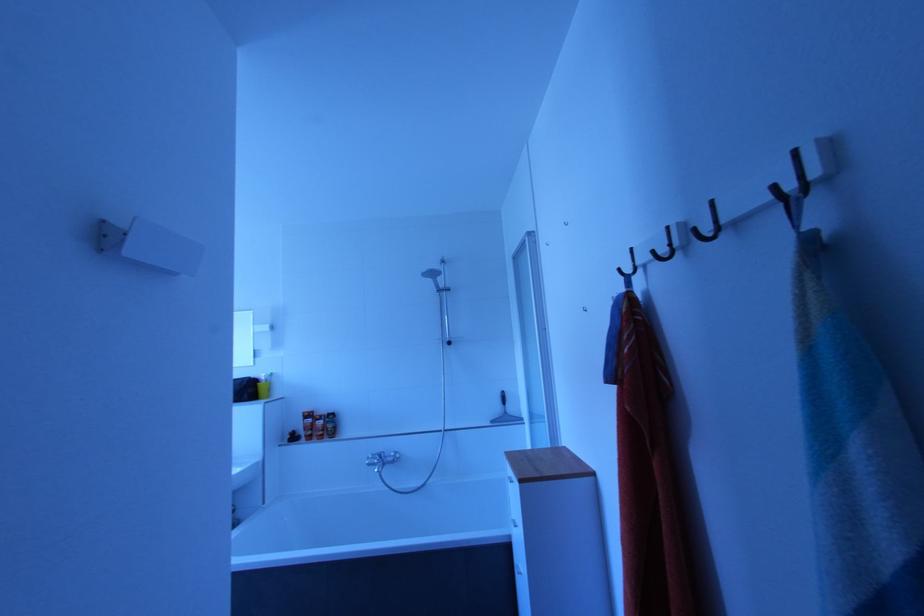
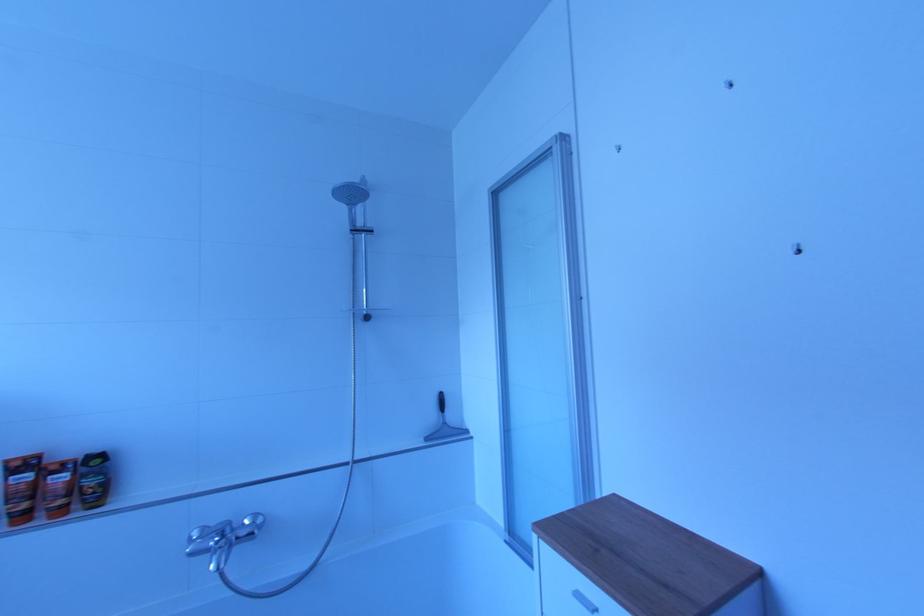
Question: How did the camera likely rotate?

Choices:
 (A) Left
 (B) Right
 (C) Up
 (D) Down

Answer: (B)